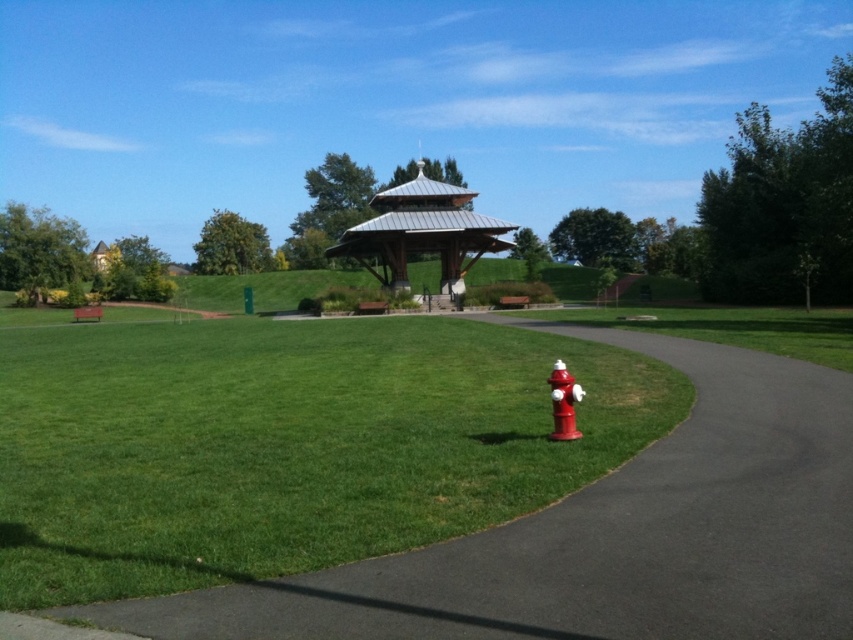
Based on the photo, you are standing at the entrance of the park and see the smooth asphalt pavement at center. If you walk straight towards it, how far will you have to walk to reach it?

The smooth asphalt pavement at center is 12.24 feet away from the viewer, so you will have to walk 12.24 feet to reach it.

You are a park visitor who wants to locate the shiny red fire hydrant at lower right. From the metallic silver gazebo at center, in which direction should you look to find it?

The metallic silver gazebo at center is positioned over the shiny red fire hydrant at lower right, so you should look downward from the gazebo to find the fire hydrant below.

You are a park visitor trying to find a place to sit. The smooth asphalt pavement at center and the metallic silver gazebo at center are both visible. Which one has a larger area?

The metallic silver gazebo at center has a larger area than the smooth asphalt pavement at center because the smooth asphalt pavement at center occupies less space than metallic silver gazebo at center.